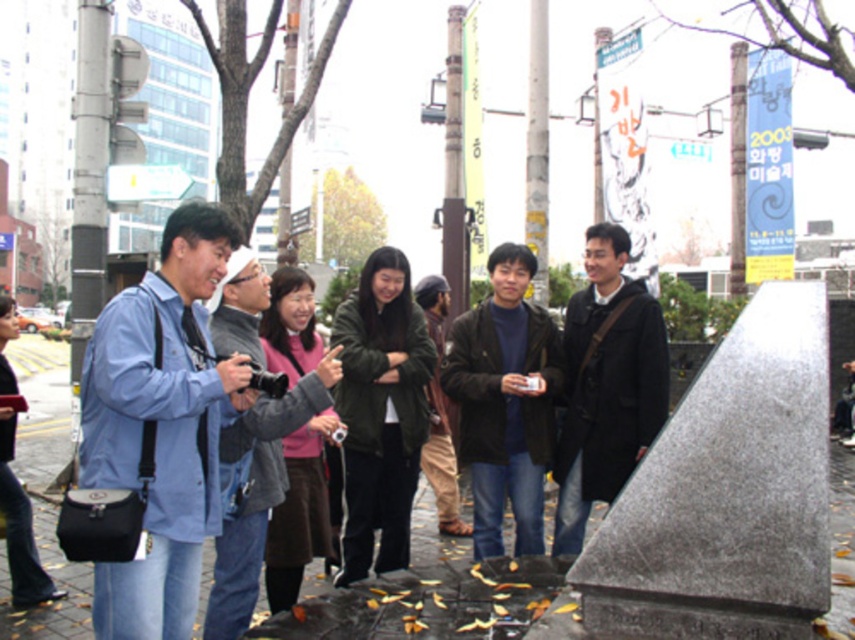
Question: Does dark brown leather jacket at center appear on the left side of matte blue jacket at left?

Choices:
 (A) yes
 (B) no

Answer: (B)

Question: Which object is positioned farthest from the dark brown leather jacket at center?

Choices:
 (A) black wool coat at center
 (B) dark green jacket at center
 (C) matte blue jacket at left
 (D) khaki cotton pants at center

Answer: (C)

Question: Which is nearer to the matte blue jacket at left?

Choices:
 (A) pink fleece jacket at center
 (B) dark green jacket at center
 (C) dark brown leather jacket at center

Answer: (A)

Question: Can you confirm if pink fleece jacket at center is positioned to the left of khaki cotton pants at center?

Choices:
 (A) no
 (B) yes

Answer: (B)

Question: Which of these objects is positioned closest to the matte blue jacket at left?

Choices:
 (A) khaki cotton pants at center
 (B) denim jacket at left
 (C) black wool coat at center
 (D) dark green jacket at center

Answer: (B)

Question: Can you confirm if denim jacket at left is thinner than matte blue jacket at left?

Choices:
 (A) yes
 (B) no

Answer: (B)